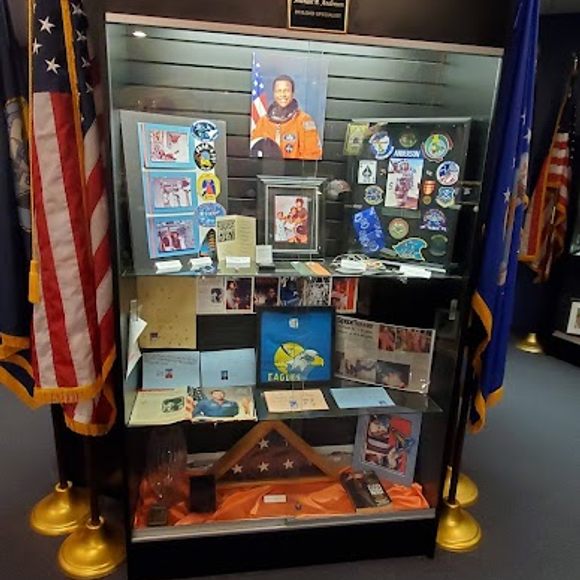
Locate an element on the screen. The image size is (580, 580). yellow tassel is located at coordinates coord(39,287).